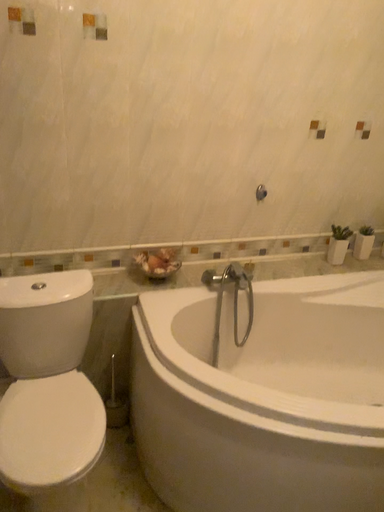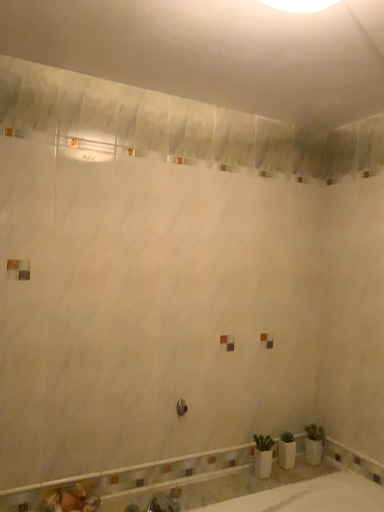
Question: Which way did the camera rotate in the video?

Choices:
 (A) rotated right
 (B) rotated left

Answer: (A)